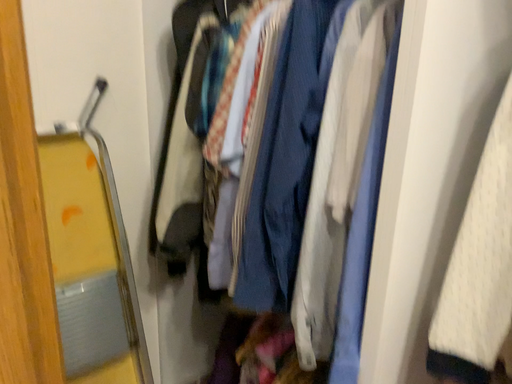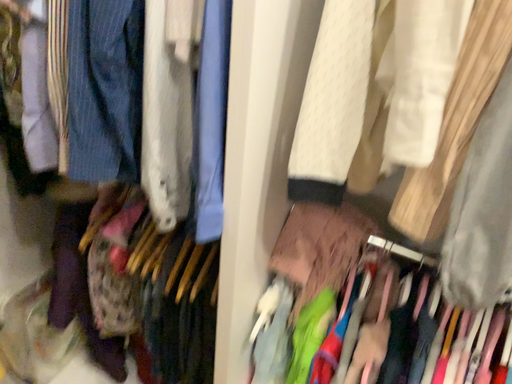
Question: How did the camera likely rotate when shooting the video?

Choices:
 (A) rotated upward
 (B) rotated downward

Answer: (B)